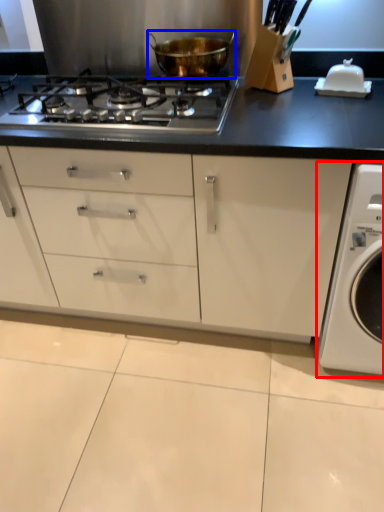
Question: Which object appears closest to the camera in this image, washing machine (highlighted by a red box) or kitchen appliance (highlighted by a blue box)?

Choices:
 (A) washing machine
 (B) kitchen appliance

Answer: (A)